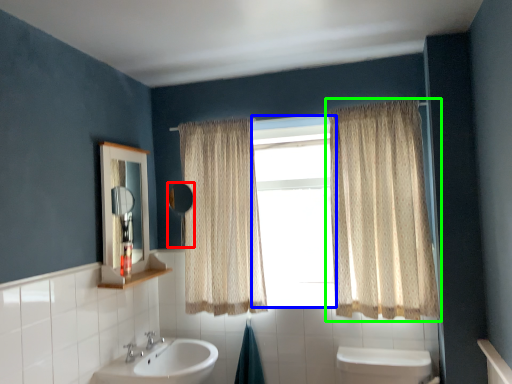
Question: Which object is positioned closest to mirror (highlighted by a red box)? Select from window (highlighted by a blue box) and curtain (highlighted by a green box).

Choices:
 (A) window
 (B) curtain

Answer: (A)